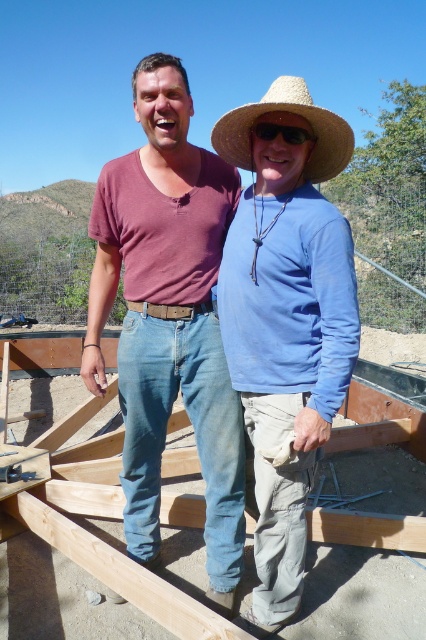
Who is more distant from viewer, (290, 556) or (316, 179)?

The point (316, 179) is behind.

Who is taller, matte straw hat at center or straw hat at center?

Standing taller between the two is matte straw hat at center.

This screenshot has width=426, height=640. I want to click on matte straw hat at center, so coord(285,316).

Image resolution: width=426 pixels, height=640 pixels. Describe the element at coordinates (169, 317) in the screenshot. I see `matte brown shirt at center` at that location.

Measure the distance between matte brown shirt at center and camera.

They are 2.01 meters apart.

Locate an element on the screen. The height and width of the screenshot is (640, 426). matte brown shirt at center is located at coordinates (169, 317).

Can you confirm if matte brown shirt at center is wider than straw hat at center?

Yes, matte brown shirt at center is wider than straw hat at center.

Between point (229, 500) and point (313, 112), which one is positioned behind?

The point (229, 500) is behind.

The image size is (426, 640). Identify the location of matte brown shirt at center. (169, 317).